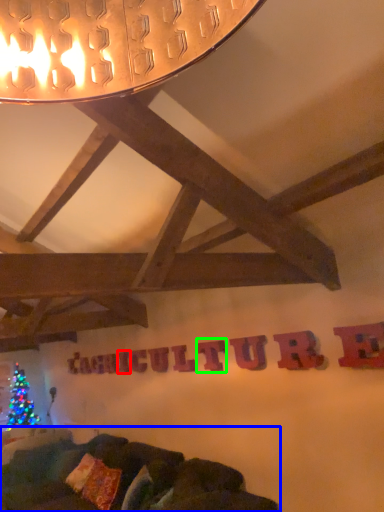
Question: Which object is the farthest from letter (highlighted by a red box)? Choose among these: studio couch (highlighted by a blue box) or letter (highlighted by a green box).

Choices:
 (A) studio couch
 (B) letter

Answer: (B)